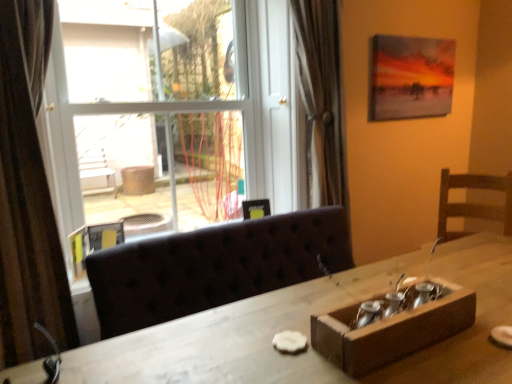
What are the coordinates of `vacant space to the right of wooden box at lower right` in the screenshot? It's located at (477, 333).